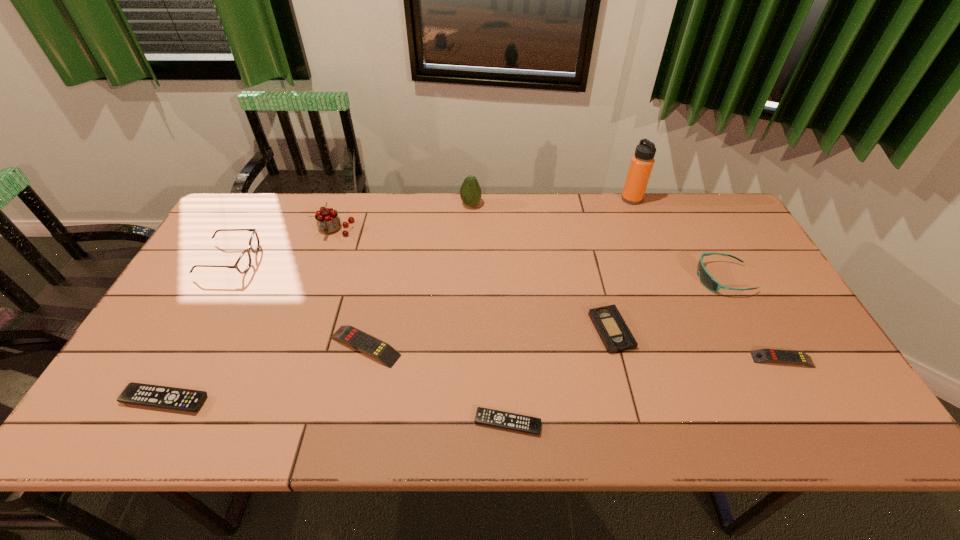
Find the location of a particular element. This screenshot has height=540, width=960. orange thermos bottle is located at coordinates (642, 162).

Find the location of a particular element. the third object from right to left is located at coordinates (642, 162).

The width and height of the screenshot is (960, 540). In order to click on avocado in this screenshot , I will do `click(470, 192)`.

Find the location of a particular element. red cherry is located at coordinates (328, 221).

Where is `the eighth object from right to left`? The width and height of the screenshot is (960, 540). the eighth object from right to left is located at coordinates (328, 221).

Find the location of a particular element. Image resolution: width=960 pixels, height=540 pixels. spectacles is located at coordinates (243, 263).

Where is `cyan sunglasses`? The height and width of the screenshot is (540, 960). cyan sunglasses is located at coordinates (706, 279).

Find the location of a particular element. the seventh object from right to left is located at coordinates (x=353, y=337).

Identify the location of the left yellow remote control. The image size is (960, 540). (353, 337).

Where is `the right yellow remote control`? Image resolution: width=960 pixels, height=540 pixels. the right yellow remote control is located at coordinates (762, 355).